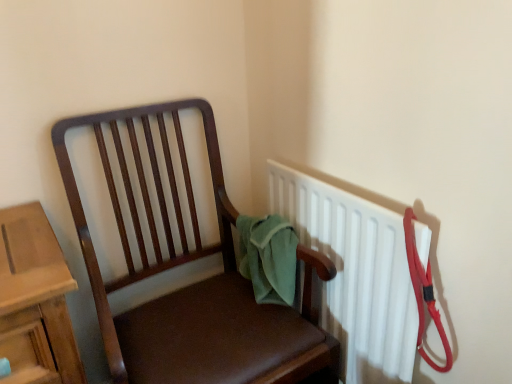
At what (x,y) coordinates should I click in order to perform the action: click on matte brown chair at center. Please return your answer as a coordinate pair (x, y). This screenshot has width=512, height=384. Looking at the image, I should click on (195, 283).

What do you see at coordinates (195, 283) in the screenshot?
I see `matte brown chair at center` at bounding box center [195, 283].

Image resolution: width=512 pixels, height=384 pixels. I want to click on white plastic radiator at upper right, so click(355, 274).

Describe the element at coordinates (355, 274) in the screenshot. I see `white plastic radiator at upper right` at that location.

At what (x,y) coordinates should I click in order to perform the action: click on matte brown chair at center. Please return your answer as a coordinate pair (x, y). The image size is (512, 384). Looking at the image, I should click on (195, 283).

Considering the relative positions of white plastic radiator at upper right and matte brown chair at center in the image provided, is white plastic radiator at upper right to the right of matte brown chair at center from the viewer's perspective?

Yes, white plastic radiator at upper right is to the right of matte brown chair at center.

Does white plastic radiator at upper right lie in front of matte brown chair at center?

No, the depth of white plastic radiator at upper right is greater than that of matte brown chair at center.

Does point (394, 264) come in front of point (160, 251)?

That is True.

From the image's perspective, does white plastic radiator at upper right appear lower than matte brown chair at center?

No, from the image's perspective, white plastic radiator at upper right is not below matte brown chair at center.

From a real-world perspective, which is physically above, white plastic radiator at upper right or matte brown chair at center?

white plastic radiator at upper right.

Can you confirm if white plastic radiator at upper right is wider than matte brown chair at center?

In fact, white plastic radiator at upper right might be narrower than matte brown chair at center.

Considering the sizes of white plastic radiator at upper right and matte brown chair at center in the image, is white plastic radiator at upper right taller or shorter than matte brown chair at center?

white plastic radiator at upper right is shorter than matte brown chair at center.

Between white plastic radiator at upper right and matte brown chair at center, which one has larger size?

matte brown chair at center.

Do you think white plastic radiator at upper right is within matte brown chair at center, or outside of it?

The correct answer is: outside.

Is white plastic radiator at upper right positioned far away from matte brown chair at center?

Actually, white plastic radiator at upper right and matte brown chair at center are a little close together.

Is matte brown chair at center at the back of white plastic radiator at upper right?

Correct, white plastic radiator at upper right is looking away from matte brown chair at center.

How many degrees apart are the facing directions of white plastic radiator at upper right and matte brown chair at center?

white plastic radiator at upper right and matte brown chair at center are facing 89.1 degrees away from each other.

How distant is white plastic radiator at upper right from matte brown chair at center?

white plastic radiator at upper right and matte brown chair at center are 9.72 inches apart from each other.

This screenshot has height=384, width=512. Identify the location of chair in front of the white plastic radiator at upper right. (195, 283).

Does matte brown chair at center appear on the left side of white plastic radiator at upper right?

Yes.

Between matte brown chair at center and white plastic radiator at upper right, which one is positioned in front?

Positioned in front is matte brown chair at center.

Is point (321, 259) in front of point (385, 343)?

No.

From the image's perspective, which one is positioned higher, matte brown chair at center or white plastic radiator at upper right?

white plastic radiator at upper right is shown above in the image.

From a real-world perspective, who is located higher, matte brown chair at center or white plastic radiator at upper right?

From a 3D spatial view, white plastic radiator at upper right is above.

Which of these two, matte brown chair at center or white plastic radiator at upper right, is thinner?

Thinner between the two is white plastic radiator at upper right.

In the scene shown: Does matte brown chair at center have a lesser height compared to white plastic radiator at upper right?

No.

Considering the sizes of objects matte brown chair at center and white plastic radiator at upper right in the image provided, who is smaller, matte brown chair at center or white plastic radiator at upper right?

white plastic radiator at upper right is smaller.

Is matte brown chair at center situated inside white plastic radiator at upper right or outside?

matte brown chair at center is not enclosed by white plastic radiator at upper right.

Would you say matte brown chair at center is a long distance from white plastic radiator at upper right?

No, there isn't a large distance between matte brown chair at center and white plastic radiator at upper right.

Is matte brown chair at center positioned with its back to white plastic radiator at upper right?

No, white plastic radiator at upper right is not at the back of matte brown chair at center.

How many degrees apart are the facing directions of matte brown chair at center and white plastic radiator at upper right?

matte brown chair at center and white plastic radiator at upper right are facing 89.1 degrees away from each other.

How distant is matte brown chair at center from white plastic radiator at upper right?

matte brown chair at center is 9.72 inches from white plastic radiator at upper right.

In order to click on radiator that is on the right side of matte brown chair at center in this screenshot , I will do `click(355, 274)`.

Where is `chair below the white plastic radiator at upper right (from a real-world perspective)`? This screenshot has height=384, width=512. chair below the white plastic radiator at upper right (from a real-world perspective) is located at coordinates (195, 283).

Where is `radiator located above the matte brown chair at center (from a real-world perspective)`? The width and height of the screenshot is (512, 384). radiator located above the matte brown chair at center (from a real-world perspective) is located at coordinates (355, 274).